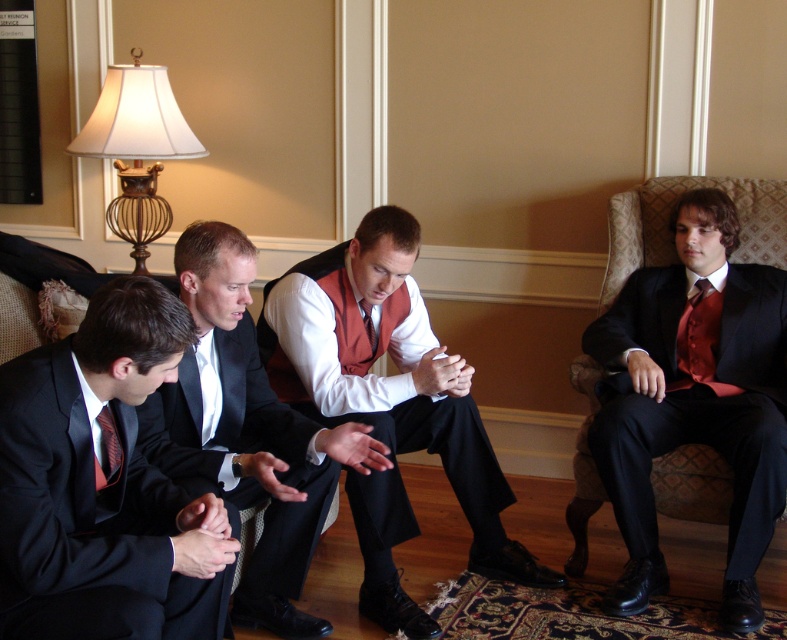
Is point (21, 616) positioned after point (100, 420)?

No, (21, 616) is in front of (100, 420).

You are a GUI agent. You are given a task and a screenshot of the screen. Output one action in this format:
    pyautogui.click(x=<x>, y=<y>)
    Task: Click on the matte black suit at left
    
    Given the screenshot: What is the action you would take?
    pyautogui.click(x=102, y=486)

You are a GUI agent. You are given a task and a screenshot of the screen. Output one action in this format:
    pyautogui.click(x=<x>, y=<y>)
    Task: Click on the matte black suit at left
    Image resolution: width=787 pixels, height=640 pixels.
    Given the screenshot: What is the action you would take?
    pyautogui.click(x=102, y=486)

Between matte black suit at center and matte red tie at center, which one appears on the right side from the viewer's perspective?

matte red tie at center is more to the right.

Can you confirm if matte black suit at center is taller than matte red tie at center?

Yes, matte black suit at center is taller than matte red tie at center.

Based on the photo, who is more distant from viewer, [164,458] or [366,308]?

Point [366,308]

Where is `matte black suit at center`? The height and width of the screenshot is (640, 787). matte black suit at center is located at coordinates (246, 433).

Is matte red vest at center taller than matte red tie at center?

Yes, matte red vest at center is taller than matte red tie at center.

Can you confirm if matte red vest at center is positioned below matte red tie at center?

Yes.

Describe the element at coordinates (388, 404) in the screenshot. I see `matte red vest at center` at that location.

I want to click on matte red vest at center, so click(388, 404).